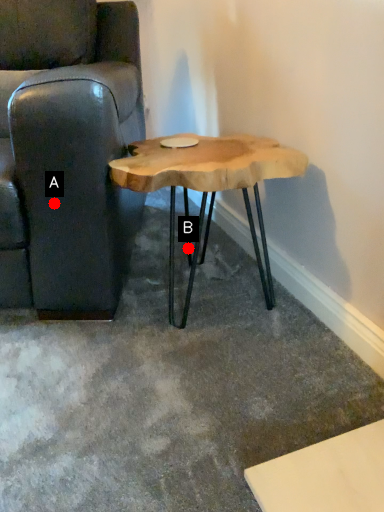
Question: Two points are circled on the image, labeled by A and B beside each circle. Which point is closer to the camera?

Choices:
 (A) A is closer
 (B) B is closer

Answer: (A)